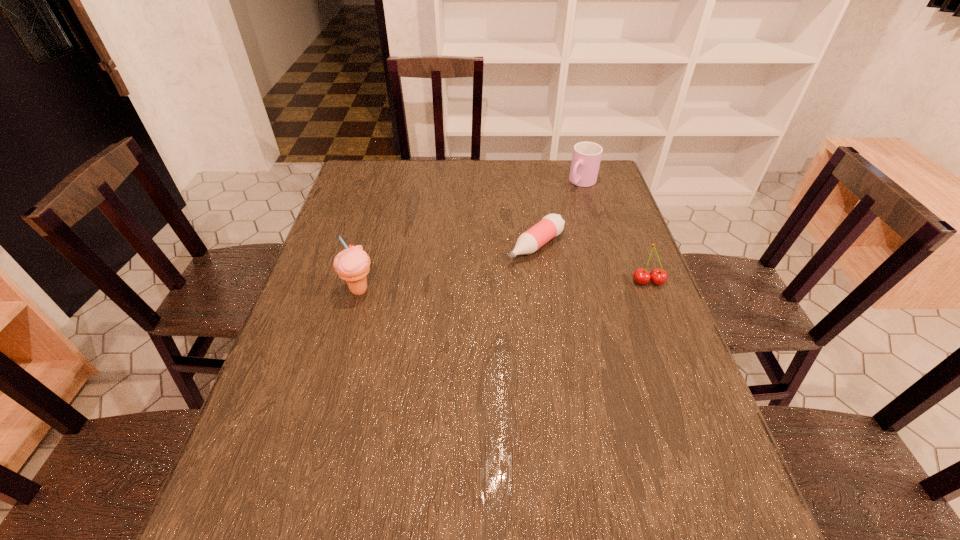
Where is `icecream`? The height and width of the screenshot is (540, 960). icecream is located at coordinates (352, 264).

Image resolution: width=960 pixels, height=540 pixels. Find the location of `the tallest object`. the tallest object is located at coordinates (352, 264).

Where is `cherry`? cherry is located at coordinates (658, 276).

I want to click on the second object from right to left, so click(586, 157).

You are a GUI agent. You are given a task and a screenshot of the screen. Output one action in this format:
    pyautogui.click(x=<x>, y=<y>)
    Task: Click on the farthest object
    
    Given the screenshot: What is the action you would take?
    pyautogui.click(x=586, y=157)

Where is `bottle`? This screenshot has width=960, height=540. bottle is located at coordinates (551, 225).

Locate an element on the screen. The height and width of the screenshot is (540, 960). the shortest object is located at coordinates (551, 225).

This screenshot has height=540, width=960. Find the location of `vacant space located on the right of the leftmost object`. vacant space located on the right of the leftmost object is located at coordinates (505, 291).

Where is `free point located with the stems of the rightmost object pointing upwards`? free point located with the stems of the rightmost object pointing upwards is located at coordinates (660, 314).

This screenshot has height=540, width=960. I want to click on vacant area located 0.200m with the handle on the side of the cup, so click(546, 219).